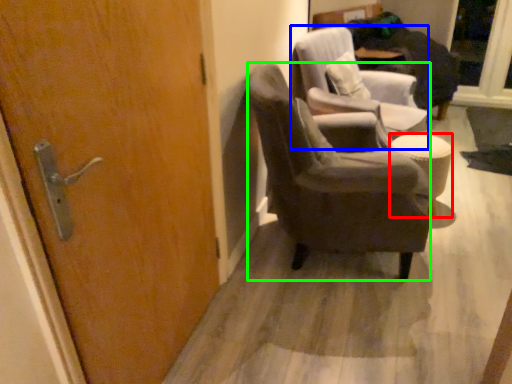
Question: Which is farther away from stool (highlighted by a red box)? chair (highlighted by a blue box) or chair (highlighted by a green box)?

Choices:
 (A) chair
 (B) chair

Answer: (B)